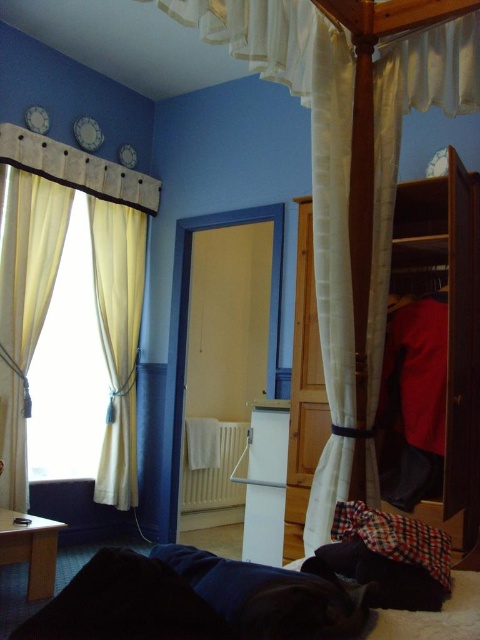
You are standing in the bedroom and want to move from the light beige curtain at left to the wooden wardrobe at right. Which direction should you move in?

You should move to the right to reach the wooden wardrobe at right from the light beige curtain at left since it is positioned to the right of it.

You are standing in the bedroom and want to hang a new painting. The wooden wardrobe at right and the matte white curtain at left are in your way. Which one is shorter and thus easier to hang a painting above?

The wooden wardrobe at right is not as tall as the matte white curtain at left, so it is shorter and easier to hang a painting above.

You are organizing the bedroom and want to place a new painting between the wooden wardrobe at right and the matte cream curtain at left. Based on their positions, which object should the painting be closer to?

The wooden wardrobe at right is positioned over the matte cream curtain at left, so the painting should be placed closer to the wooden wardrobe at right since it is above the curtain.